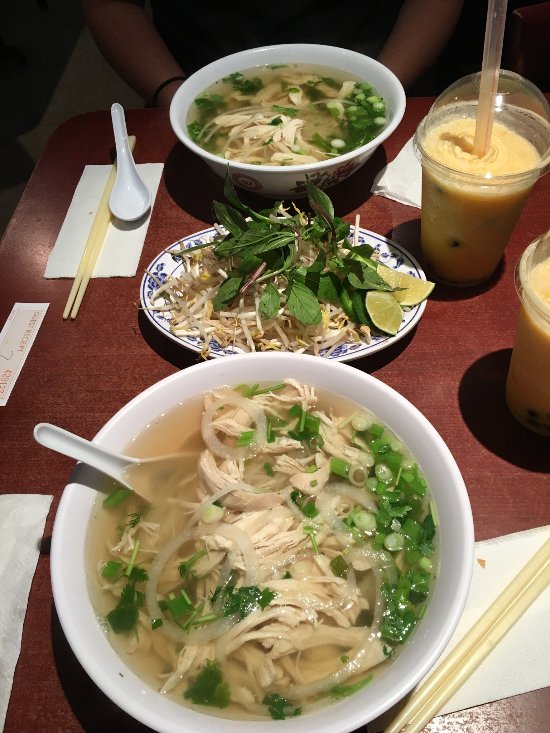
Where is `chopsticks`? The height and width of the screenshot is (733, 550). chopsticks is located at coordinates (462, 673), (90, 254).